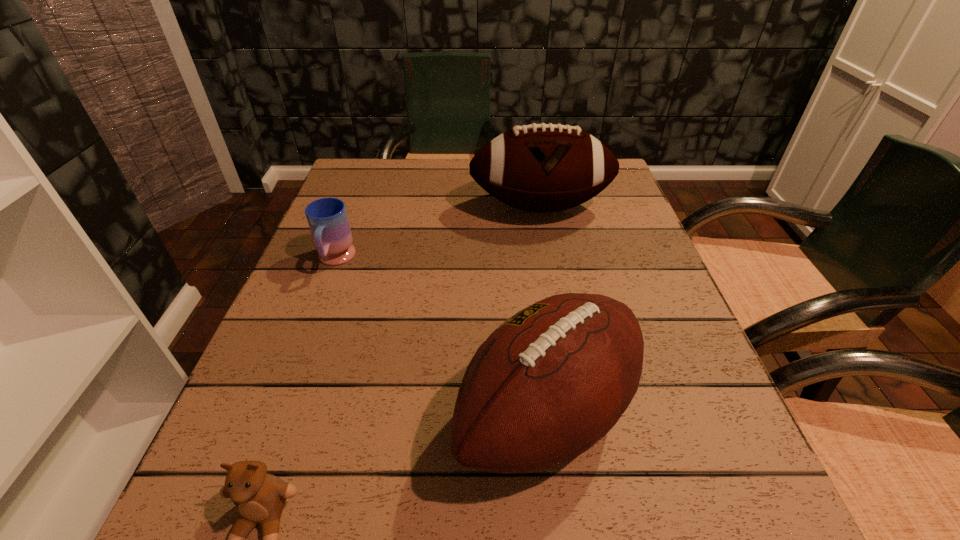
Image resolution: width=960 pixels, height=540 pixels. Identify the location of object that can be found as the closest to the farther football (American). (327, 218).

Point out which object is positioned as the nearest to the nearer football (American). Please provide its 2D coordinates. Your answer should be formatted as a tuple, i.e. [(x, y)], where the tuple contains the x and y coordinates of a point satisfying the conditions above.

[(259, 497)]

Locate an element on the screen. vacant region that satisfies the following two spatial constraints: 1. on the side of the nearer football (American) with the handle; 2. on the left side of the mug is located at coordinates (276, 415).